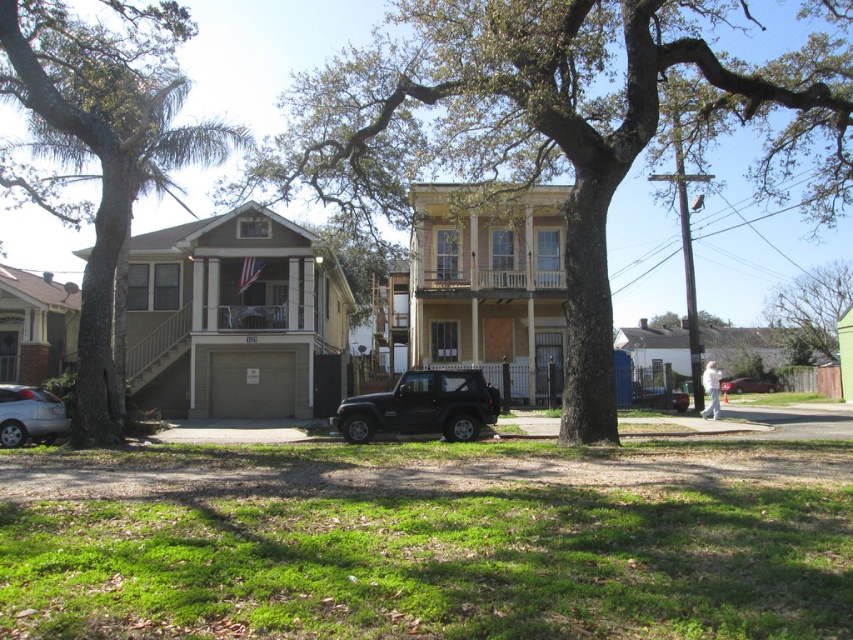
You are a delivery person trying to park your vehicle in the residential area shown. You see the brown textured tree at center and the black matte suv at center. Which object is blocking the path to the parking spot?

The brown textured tree at center is positioned over the black matte suv at center, so the tree is blocking the path to the parking spot.

You are a delivery person trying to park your metallic silver car at center in the residential area. The green leafy tree at left is blocking the parking spot. Can you drive under the tree without hitting the branches?

The green leafy tree at left has a greater height compared to metallic silver car at center, so the branches may be high enough to allow the car to pass underneath without hitting them. However, it depends on the specific clearance of the tree branches and the height of the car.